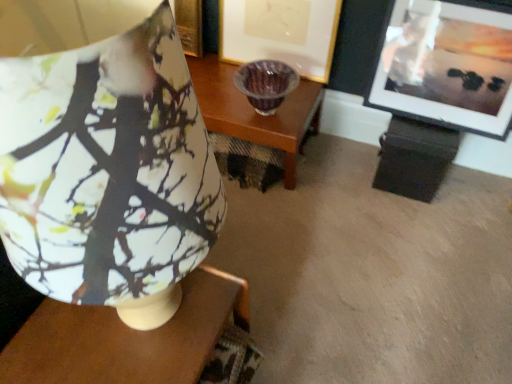
Question: Should I look upward or downward to see matte gold picture frame at center, which is counted as the 2th picture frame, starting from the right?

Choices:
 (A) down
 (B) up

Answer: (B)

Question: Considering the relative sizes of matte black picture frame at upper right, marked as the 2th picture frame in a left-to-right arrangement, and matte ceramic lampshade at upper left in the image provided, is matte black picture frame at upper right, marked as the 2th picture frame in a left-to-right arrangement, wider than matte ceramic lampshade at upper left?

Choices:
 (A) yes
 (B) no

Answer: (B)

Question: From a real-world perspective, does matte black picture frame at upper right, marked as the 2th picture frame in a left-to-right arrangement, stand above matte ceramic lampshade at upper left?

Choices:
 (A) yes
 (B) no

Answer: (B)

Question: Considering the relative sizes of matte black picture frame at upper right, which is counted as the 1th picture frame, starting from the right, and matte ceramic lampshade at upper left in the image provided, is matte black picture frame at upper right, which is counted as the 1th picture frame, starting from the right, taller than matte ceramic lampshade at upper left?

Choices:
 (A) no
 (B) yes

Answer: (A)

Question: Considering the relative sizes of matte black picture frame at upper right, which is counted as the 1th picture frame, starting from the right, and matte ceramic lampshade at upper left in the image provided, is matte black picture frame at upper right, which is counted as the 1th picture frame, starting from the right, shorter than matte ceramic lampshade at upper left?

Choices:
 (A) yes
 (B) no

Answer: (A)

Question: Is the surface of matte black picture frame at upper right, marked as the 2th picture frame in a left-to-right arrangement, in direct contact with matte ceramic lampshade at upper left?

Choices:
 (A) yes
 (B) no

Answer: (B)

Question: Considering the relative sizes of matte black picture frame at upper right, which is counted as the 1th picture frame, starting from the right, and matte ceramic lampshade at upper left in the image provided, is matte black picture frame at upper right, which is counted as the 1th picture frame, starting from the right, smaller than matte ceramic lampshade at upper left?

Choices:
 (A) no
 (B) yes

Answer: (B)

Question: From the image's perspective, is matte wood table at center beneath matte black picture frame at upper right, marked as the 2th picture frame in a left-to-right arrangement?

Choices:
 (A) no
 (B) yes

Answer: (B)

Question: Does matte wood table at center have a smaller size compared to matte black picture frame at upper right, which is counted as the 1th picture frame, starting from the right?

Choices:
 (A) yes
 (B) no

Answer: (B)

Question: Can you confirm if matte wood table at center is thinner than matte black picture frame at upper right, marked as the 2th picture frame in a left-to-right arrangement?

Choices:
 (A) no
 (B) yes

Answer: (A)

Question: Considering the relative positions of matte wood table at center and matte black picture frame at upper right, marked as the 2th picture frame in a left-to-right arrangement, in the image provided, is matte wood table at center behind matte black picture frame at upper right, marked as the 2th picture frame in a left-to-right arrangement,?

Choices:
 (A) no
 (B) yes

Answer: (A)

Question: Does matte wood table at center appear on the left side of matte black picture frame at upper right, which is counted as the 1th picture frame, starting from the right?

Choices:
 (A) no
 (B) yes

Answer: (B)

Question: Considering the relative sizes of matte wood table at center and matte black picture frame at upper right, marked as the 2th picture frame in a left-to-right arrangement, in the image provided, is matte wood table at center taller than matte black picture frame at upper right, marked as the 2th picture frame in a left-to-right arrangement,?

Choices:
 (A) yes
 (B) no

Answer: (B)

Question: From a real-world perspective, does matte black picture frame at upper right, which is counted as the 1th picture frame, starting from the right, sit lower than matte gold picture frame at center, which is counted as the 2th picture frame, starting from the right?

Choices:
 (A) no
 (B) yes

Answer: (A)